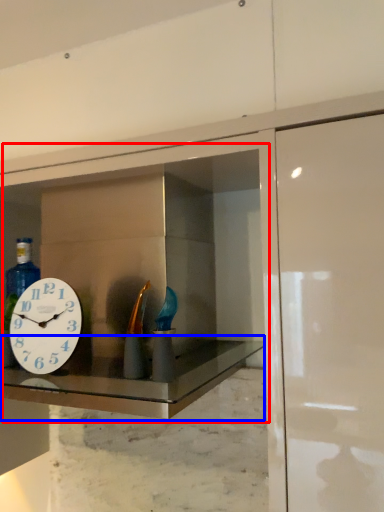
Question: Among these objects, which one is farthest to the camera, medicine cabinet (highlighted by a red box) or counter top (highlighted by a blue box)?

Choices:
 (A) medicine cabinet
 (B) counter top

Answer: (A)